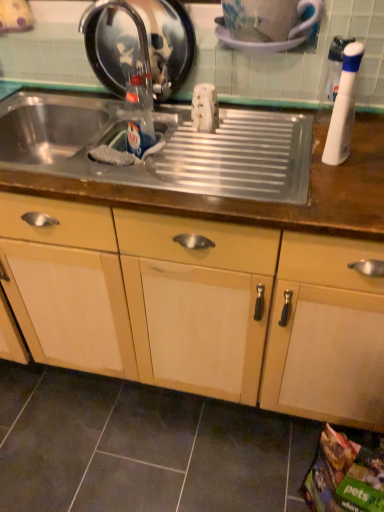
Question: From the image's perspective, is clear glass bottle at center, which ranks as the 2th bottle in front-to-back order, on matte wood cabinet at center?

Choices:
 (A) no
 (B) yes

Answer: (B)

Question: From a real-world perspective, is clear glass bottle at center, arranged as the first bottle when viewed from the left, under matte wood cabinet at center?

Choices:
 (A) no
 (B) yes

Answer: (A)

Question: Is clear glass bottle at center, which ranks as the 2th bottle in right-to-left order, taller than matte wood cabinet at center?

Choices:
 (A) no
 (B) yes

Answer: (A)

Question: Is the surface of clear glass bottle at center, which ranks as the 2th bottle in front-to-back order, in direct contact with matte wood cabinet at center?

Choices:
 (A) yes
 (B) no

Answer: (B)

Question: Is clear glass bottle at center, the 1th bottle viewed from the back, oriented towards matte wood cabinet at center?

Choices:
 (A) no
 (B) yes

Answer: (A)

Question: Considering the positions of glossy ceramic mug at upper center and metallic stainless steel tray at center in the image, is glossy ceramic mug at upper center wider or thinner than metallic stainless steel tray at center?

Choices:
 (A) thin
 (B) wide

Answer: (A)

Question: Considering the positions of glossy ceramic mug at upper center and metallic stainless steel tray at center in the image, is glossy ceramic mug at upper center taller or shorter than metallic stainless steel tray at center?

Choices:
 (A) short
 (B) tall

Answer: (A)

Question: Considering the relative positions of glossy ceramic mug at upper center and metallic stainless steel tray at center in the image provided, is glossy ceramic mug at upper center to the left or to the right of metallic stainless steel tray at center?

Choices:
 (A) right
 (B) left

Answer: (A)

Question: From the image's perspective, relative to metallic stainless steel tray at center, is glossy ceramic mug at upper center above or below?

Choices:
 (A) above
 (B) below

Answer: (A)

Question: From the image's perspective, is satin nickel faucet at upper left above or below clear glass bottle at center, which ranks as the 2th bottle in front-to-back order?

Choices:
 (A) below
 (B) above

Answer: (B)

Question: Considering the positions of satin nickel faucet at upper left and clear glass bottle at center, which ranks as the 2th bottle in front-to-back order, in the image, is satin nickel faucet at upper left bigger or smaller than clear glass bottle at center, which ranks as the 2th bottle in front-to-back order,?

Choices:
 (A) small
 (B) big

Answer: (B)

Question: Based on their positions, is satin nickel faucet at upper left located to the left or right of clear glass bottle at center, which ranks as the 2th bottle in right-to-left order?

Choices:
 (A) left
 (B) right

Answer: (A)

Question: Relative to clear glass bottle at center, which ranks as the 2th bottle in front-to-back order, is satin nickel faucet at upper left in front or behind?

Choices:
 (A) behind
 (B) front

Answer: (B)

Question: Do you think metallic stainless steel tray at center is within clear glass bottle at center, the 1th bottle viewed from the back, or outside of it?

Choices:
 (A) inside
 (B) outside

Answer: (B)

Question: Based on their sizes in the image, would you say metallic stainless steel tray at center is bigger or smaller than clear glass bottle at center, arranged as the first bottle when viewed from the left?

Choices:
 (A) small
 (B) big

Answer: (B)